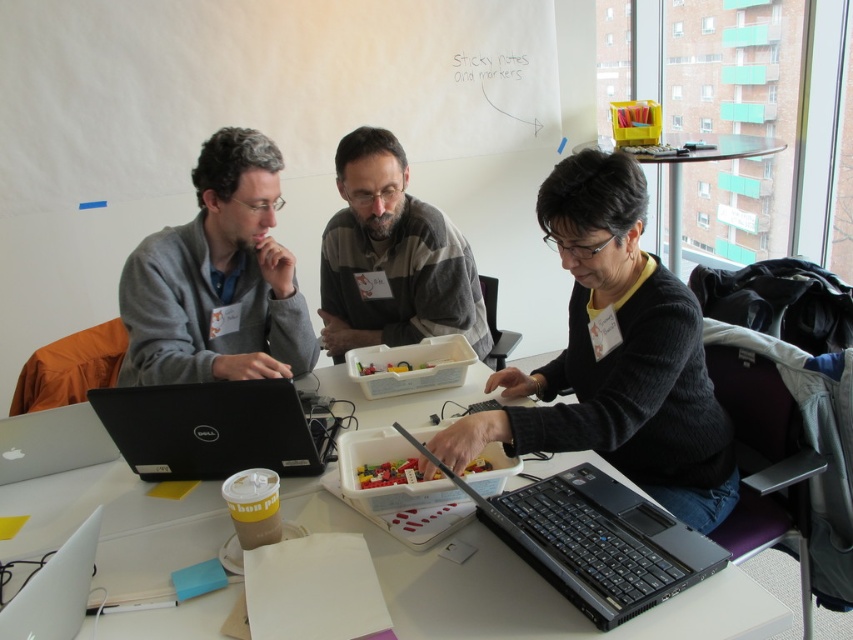
Question: Among these points, which one is nearest to the camera?

Choices:
 (A) coord(413,273)
 (B) coord(315,442)
 (C) coord(509,372)
 (D) coord(62,547)

Answer: (D)

Question: Does black matte laptop at center appear on the left side of clear glass table at upper right?

Choices:
 (A) yes
 (B) no

Answer: (A)

Question: Observing the image, what is the correct spatial positioning of white plastic table at center in reference to striped sweater at center?

Choices:
 (A) above
 (B) below

Answer: (B)

Question: Estimate the real-world distances between objects in this image. Which object is closer to the white plastic table at center?

Choices:
 (A) black matte laptop at center
 (B) silver metallic laptop at lower left
 (C) black matte sweater at center
 (D) clear glass table at upper right

Answer: (A)

Question: Is black matte laptop at center below clear glass table at upper right?

Choices:
 (A) yes
 (B) no

Answer: (A)

Question: Which object is the closest to the white plastic table at center?

Choices:
 (A) gray cardigan at left
 (B) black matte laptop at left
 (C) silver metallic laptop at lower left

Answer: (B)